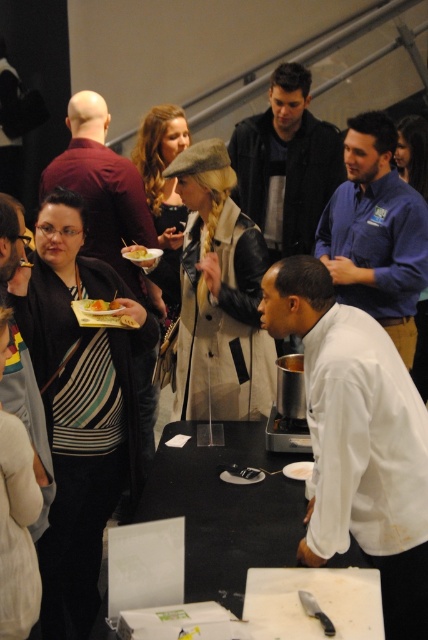
Question: In this image, where is yellowish matte plate at center located relative to matte yellow plate at center?

Choices:
 (A) above
 (B) below

Answer: (B)

Question: Which point is closer to the camera?

Choices:
 (A) metallic silver pot at center
 (B) black matte table at center

Answer: (B)

Question: Which of the following is the farthest from the observer?

Choices:
 (A) (142, 250)
 (B) (324, 196)

Answer: (B)

Question: Is yellowish matte plate at center smaller than metallic silver pot at center?

Choices:
 (A) no
 (B) yes

Answer: (B)

Question: Does black leather jacket at upper center appear over yellowish matte plate at center?

Choices:
 (A) no
 (B) yes

Answer: (B)

Question: Among these points, which one is farthest from the camera?

Choices:
 (A) (308, 198)
 (B) (91, 305)
 (C) (142, 253)

Answer: (A)